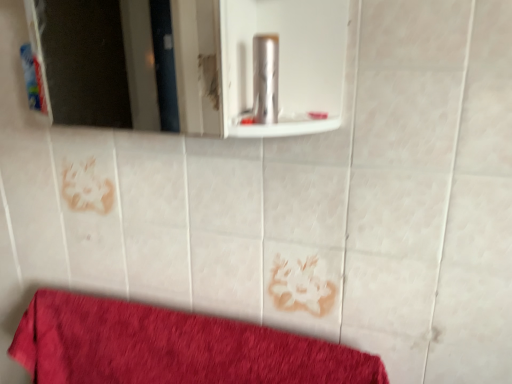
Question: From a real-world perspective, is red cotton towel at lower left over blue plastic toothpaste tube at left, the first toiletry viewed from the back?

Choices:
 (A) no
 (B) yes

Answer: (A)

Question: Can you confirm if red cotton towel at lower left is wider than blue plastic toothpaste tube at left, the first toiletry viewed from the back?

Choices:
 (A) no
 (B) yes

Answer: (B)

Question: Could you tell me if red cotton towel at lower left is turned towards blue plastic toothpaste tube at left, marked as the first toiletry in a left-to-right arrangement?

Choices:
 (A) yes
 (B) no

Answer: (B)

Question: Considering the relative sizes of red cotton towel at lower left and blue plastic toothpaste tube at left, which ranks as the second toiletry in right-to-left order, in the image provided, is red cotton towel at lower left bigger than blue plastic toothpaste tube at left, which ranks as the second toiletry in right-to-left order,?

Choices:
 (A) no
 (B) yes

Answer: (B)

Question: Does red cotton towel at lower left lie in front of blue plastic toothpaste tube at left, which ranks as the second toiletry in right-to-left order?

Choices:
 (A) no
 (B) yes

Answer: (B)

Question: Is red cotton towel at lower left to the left or to the right of white glossy mirror at upper center in the image?

Choices:
 (A) right
 (B) left

Answer: (A)

Question: Based on their sizes in the image, would you say red cotton towel at lower left is bigger or smaller than white glossy mirror at upper center?

Choices:
 (A) small
 (B) big

Answer: (A)

Question: In terms of height, does red cotton towel at lower left look taller or shorter compared to white glossy mirror at upper center?

Choices:
 (A) short
 (B) tall

Answer: (B)

Question: Is red cotton towel at lower left inside the boundaries of white glossy mirror at upper center, or outside?

Choices:
 (A) outside
 (B) inside

Answer: (A)

Question: Would you say blue plastic toothpaste tube at left, marked as the first toiletry in a left-to-right arrangement, is inside or outside white glossy mirror at upper center?

Choices:
 (A) outside
 (B) inside

Answer: (B)

Question: Considering the positions of blue plastic toothpaste tube at left, which ranks as the 2th toiletry in front-to-back order, and white glossy mirror at upper center in the image, is blue plastic toothpaste tube at left, which ranks as the 2th toiletry in front-to-back order, taller or shorter than white glossy mirror at upper center?

Choices:
 (A) tall
 (B) short

Answer: (B)

Question: In the image, is blue plastic toothpaste tube at left, marked as the first toiletry in a left-to-right arrangement, positioned in front of or behind white glossy mirror at upper center?

Choices:
 (A) behind
 (B) front

Answer: (A)

Question: From the image's perspective, relative to white glossy mirror at upper center, is blue plastic toothpaste tube at left, the first toiletry viewed from the back, above or below?

Choices:
 (A) below
 (B) above

Answer: (B)

Question: Relative to white glossy mirror at upper center, is metallic silver canister at center, which is the 1th toiletry from right to left, in front or behind?

Choices:
 (A) behind
 (B) front

Answer: (A)

Question: Is metallic silver canister at center, which is the 1th toiletry from right to left, taller or shorter than white glossy mirror at upper center?

Choices:
 (A) tall
 (B) short

Answer: (B)